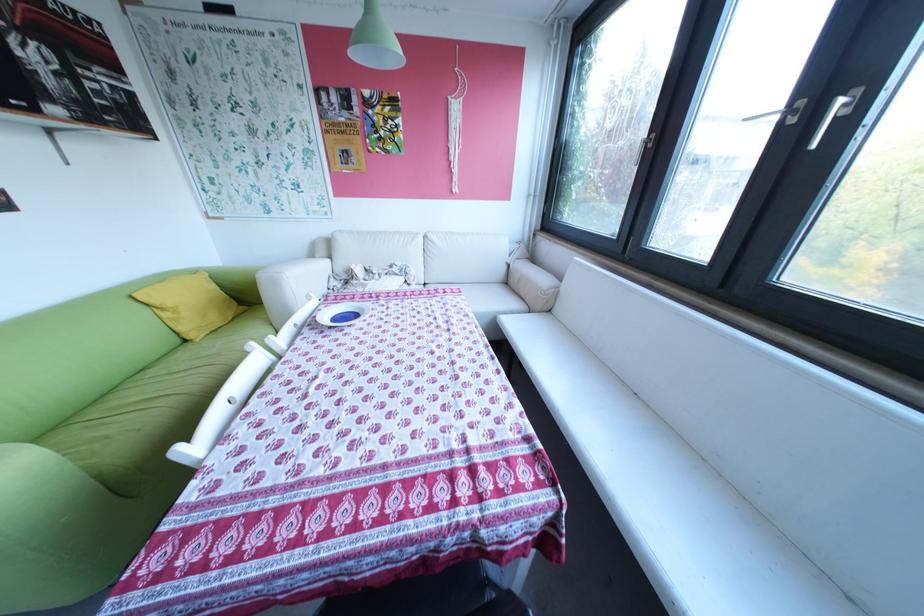
The width and height of the screenshot is (924, 616). Describe the element at coordinates (488, 297) in the screenshot. I see `a white sofa sitting surface` at that location.